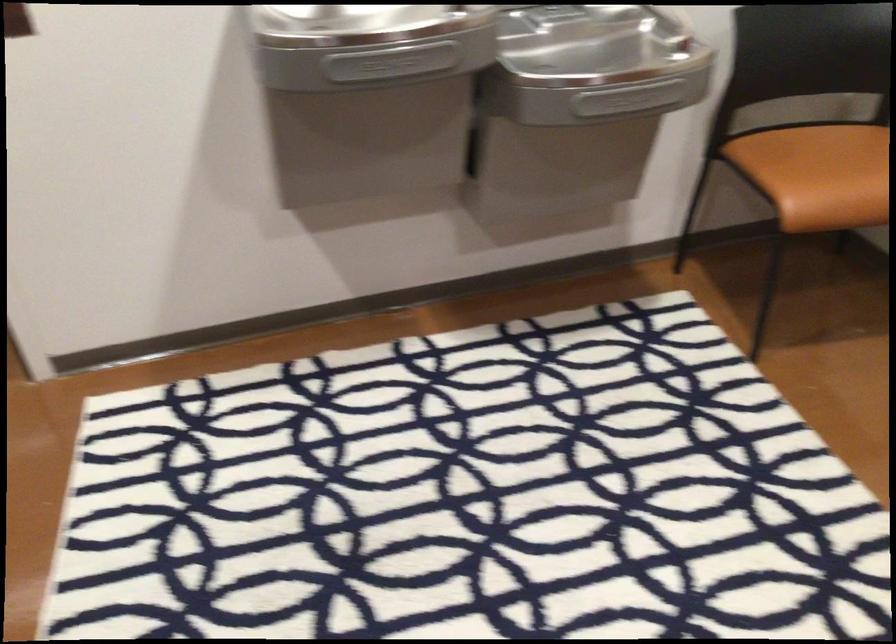
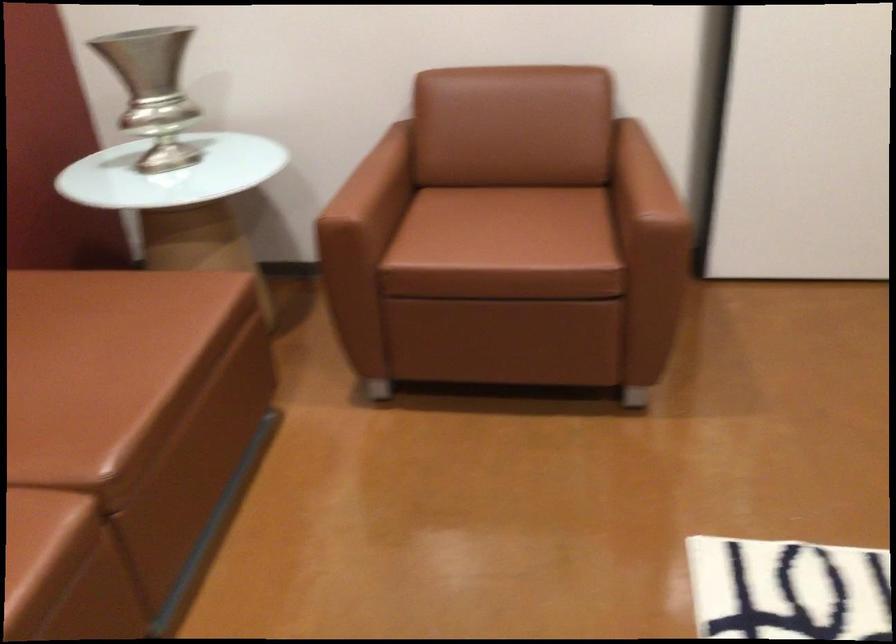
Based on the continuous images, in which direction is the camera rotating?

The rotation direction of the camera is left-down.